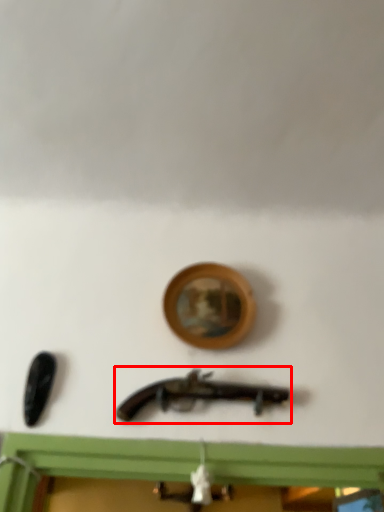
Question: Where is weapon (annotated by the red box) located in relation to picture frame in the image?

Choices:
 (A) right
 (B) left

Answer: (B)